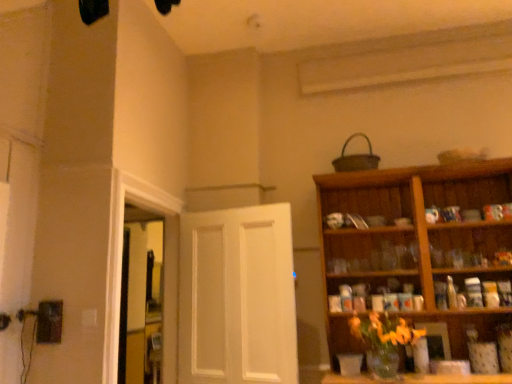
Where is `white matte door at center`? This screenshot has width=512, height=384. white matte door at center is located at coordinates (237, 297).

The height and width of the screenshot is (384, 512). Describe the element at coordinates (237, 297) in the screenshot. I see `white matte door at center` at that location.

Measure the distance between point (462, 278) and camera.

Point (462, 278) is 2.77 meters from camera.

You are a GUI agent. You are given a task and a screenshot of the screen. Output one action in this format:
    pyautogui.click(x=<x>, y=<y>)
    Task: Click on the transparent glass window at left
    This screenshot has width=512, height=384.
    Given the screenshot: What is the action you would take?
    pyautogui.click(x=141, y=297)

Considering the sizes of transparent glass window at left and white matte door at center in the image, is transparent glass window at left wider or thinner than white matte door at center?

transparent glass window at left is wider than white matte door at center.

How different are the orientations of transparent glass window at left and white matte door at center in degrees?

The angle between the facing direction of transparent glass window at left and the facing direction of white matte door at center is 11.6 degrees.

Is point (148, 214) more distant than point (188, 382)?

Yes, point (148, 214) is farther from viewer.

Is wooden cabinet at upper right positioned far away from white matte door at center?

No, wooden cabinet at upper right is in close proximity to white matte door at center.

Looking at this image, how many degrees apart are the facing directions of wooden cabinet at upper right and white matte door at center?

11.8 degrees separate the facing orientations of wooden cabinet at upper right and white matte door at center.

From a real-world perspective, which is physically below, wooden cabinet at upper right or white matte door at center?

From a 3D spatial view, white matte door at center is below.

This screenshot has height=384, width=512. Find the location of `door that is on the left side of wooden cabinet at upper right`. door that is on the left side of wooden cabinet at upper right is located at coordinates tap(237, 297).

Between white matte door at center and transparent glass window at left, which one has smaller size?

white matte door at center is smaller.

Is white matte door at center located outside transparent glass window at left?

Yes, white matte door at center is outside of transparent glass window at left.

Can you confirm if white matte door at center is positioned to the right of transparent glass window at left?

Yes, white matte door at center is to the right of transparent glass window at left.

Is white matte door at center not inside wooden cabinet at upper right?

Absolutely, white matte door at center is external to wooden cabinet at upper right.

Does white matte door at center appear on the left side of wooden cabinet at upper right?

Yes.

Can you confirm if white matte door at center is shorter than wooden cabinet at upper right?

Yes, white matte door at center is shorter than wooden cabinet at upper right.

Is wooden cabinet at upper right looking in the opposite direction of transparent glass window at left?

wooden cabinet at upper right does not have its back to transparent glass window at left.

Consider the image. Which object is thinner, wooden cabinet at upper right or transparent glass window at left?

With smaller width is transparent glass window at left.

Does wooden cabinet at upper right appear on the left side of transparent glass window at left?

No.

Considering the sizes of objects wooden cabinet at upper right and transparent glass window at left in the image provided, who is taller, wooden cabinet at upper right or transparent glass window at left?

With more height is wooden cabinet at upper right.

Does transparent glass window at left turn towards wooden cabinet at upper right?

No, transparent glass window at left is not aimed at wooden cabinet at upper right.

From a real-world perspective, is transparent glass window at left positioned under wooden cabinet at upper right based on gravity?

Indeed, from a real-world perspective, transparent glass window at left is positioned beneath wooden cabinet at upper right.

In order to click on cabinetry positioned vertically above the transparent glass window at left (from a real-world perspective) in this screenshot , I will do `click(416, 242)`.

Are transparent glass window at left and wooden cabinet at upper right located far from each other?

Yes, transparent glass window at left and wooden cabinet at upper right are quite far apart.

Identify the location of door below the transparent glass window at left (from a real-world perspective). This screenshot has width=512, height=384. (237, 297).

At what (x,y) coordinates should I click in order to perform the action: click on cabinetry on the right of the white matte door at center. Please return your answer as a coordinate pair (x, y). Looking at the image, I should click on (416, 242).

Which object lies further to the anchor point transparent glass window at left, wooden cabinet at upper right or white matte door at center?

The object further to transparent glass window at left is wooden cabinet at upper right.

Which object lies nearer to the anchor point white matte door at center, transparent glass window at left or wooden cabinet at upper right?

transparent glass window at left lies closer to white matte door at center than the other object.

Estimate the real-world distances between objects in this image. Which object is further from white matte door at center, wooden cabinet at upper right or transparent glass window at left?

Among the two, wooden cabinet at upper right is located further to white matte door at center.

Looking at the image, which one is located further to wooden cabinet at upper right, transparent glass window at left or white matte door at center?

The object further to wooden cabinet at upper right is transparent glass window at left.

Estimate the real-world distances between objects in this image. Which object is further from wooden cabinet at upper right, white matte door at center or transparent glass window at left?

transparent glass window at left is positioned further to the anchor wooden cabinet at upper right.

Which object lies further to the anchor point transparent glass window at left, white matte door at center or wooden cabinet at upper right?

wooden cabinet at upper right is further to transparent glass window at left.

Find the location of `door situated between transparent glass window at left and wooden cabinet at upper right from left to right`. door situated between transparent glass window at left and wooden cabinet at upper right from left to right is located at coordinates tap(237, 297).